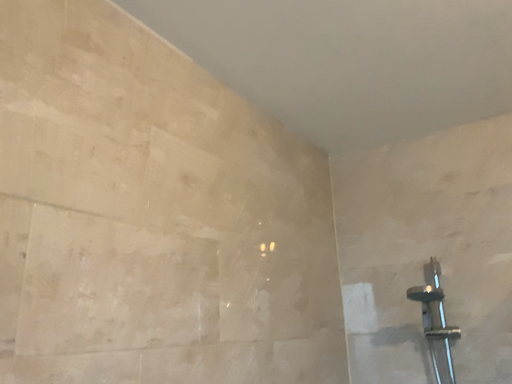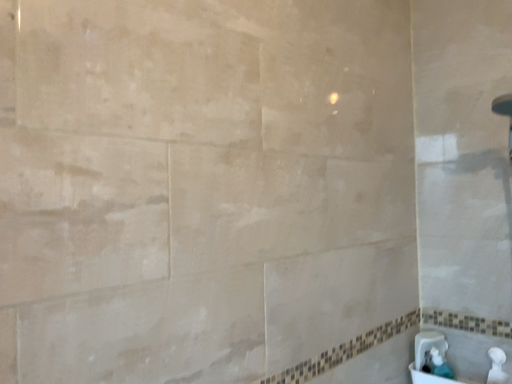
Question: How did the camera likely rotate when shooting the video?

Choices:
 (A) rotated downward
 (B) rotated upward

Answer: (A)